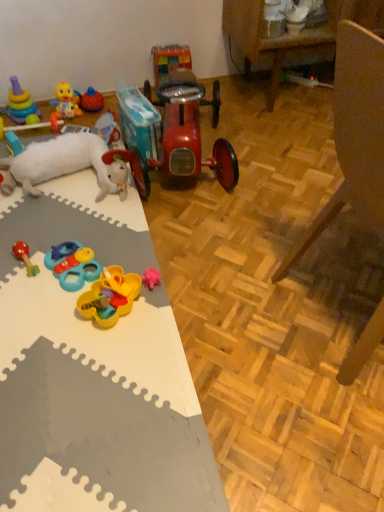
The height and width of the screenshot is (512, 384). I want to click on free location to the right of rubberized red and green rattle at lower left, which is the 4th toy from left to right, so click(94, 244).